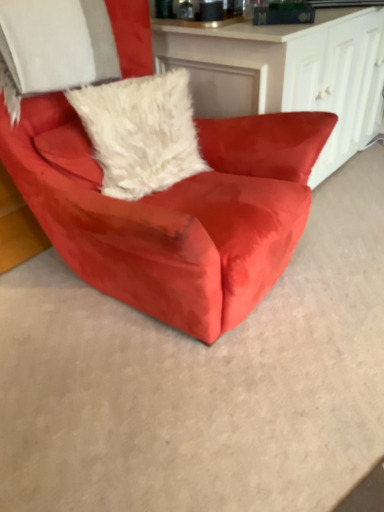
This screenshot has height=512, width=384. Describe the element at coordinates (173, 212) in the screenshot. I see `suede red armchair at center` at that location.

The width and height of the screenshot is (384, 512). What are the coordinates of `suede red armchair at center` in the screenshot? It's located at (173, 212).

What is the approximate width of suede red armchair at center?

The width of suede red armchair at center is 87.76 centimeters.

Locate an element on the screen. This screenshot has width=384, height=512. white fluffy pillow at center is located at coordinates (141, 132).

Looking at this image, measure the distance between white fluffy pillow at center and camera.

white fluffy pillow at center and camera are 1.26 meters apart from each other.

Image resolution: width=384 pixels, height=512 pixels. What do you see at coordinates (141, 132) in the screenshot?
I see `white fluffy pillow at center` at bounding box center [141, 132].

Identify the location of suede red armchair at center. (173, 212).

Is suede red armchair at center to the left or to the right of white fluffy pillow at center in the image?

suede red armchair at center is positioned on white fluffy pillow at center's right side.

Is the depth of suede red armchair at center less than that of white fluffy pillow at center?

Yes, suede red armchair at center is closer to the camera.

Which point is more distant from viewer, (308, 120) or (177, 87)?

Positioned behind is point (177, 87).

Consider the image. From the image's perspective, who appears lower, suede red armchair at center or white fluffy pillow at center?

suede red armchair at center, from the image's perspective.

From a real-world perspective, is suede red armchair at center on top of white fluffy pillow at center?

No, from a real-world perspective, suede red armchair at center is not on top of white fluffy pillow at center.

Which object is thinner, suede red armchair at center or white fluffy pillow at center?

With smaller width is white fluffy pillow at center.

Considering the relative sizes of suede red armchair at center and white fluffy pillow at center in the image provided, is suede red armchair at center taller than white fluffy pillow at center?

Indeed, suede red armchair at center has a greater height compared to white fluffy pillow at center.

Can you confirm if suede red armchair at center is smaller than white fluffy pillow at center?

No.

Is suede red armchair at center inside the boundaries of white fluffy pillow at center, or outside?

suede red armchair at center exists outside the volume of white fluffy pillow at center.

Is suede red armchair at center not close to white fluffy pillow at center?

That's not correct — suede red armchair at center is a little close to white fluffy pillow at center.

Is suede red armchair at center positioned with its back to white fluffy pillow at center?

That's right, suede red armchair at center is facing away from white fluffy pillow at center.

How distant is suede red armchair at center from white fluffy pillow at center?

The distance of suede red armchair at center from white fluffy pillow at center is 8.05 inches.

Find the location of a particular element. The height and width of the screenshot is (512, 384). pillow located above the suede red armchair at center (from the image's perspective) is located at coordinates click(x=141, y=132).

Which object is positioned more to the right, white fluffy pillow at center or suede red armchair at center?

suede red armchair at center is more to the right.

Is white fluffy pillow at center closer to camera compared to suede red armchair at center?

No.

Does point (193, 146) appear closer or farther from the camera than point (60, 212)?

Point (193, 146) is positioned farther from the camera compared to point (60, 212).

From the image's perspective, between white fluffy pillow at center and suede red armchair at center, which one is located above?

white fluffy pillow at center appears higher in the image.

From a real-world perspective, is white fluffy pillow at center above or below suede red armchair at center?

white fluffy pillow at center is above suede red armchair at center.

Can you confirm if white fluffy pillow at center is wider than suede red armchair at center?

No, white fluffy pillow at center is not wider than suede red armchair at center.

Considering the sizes of objects white fluffy pillow at center and suede red armchair at center in the image provided, who is shorter, white fluffy pillow at center or suede red armchair at center?

Standing shorter between the two is white fluffy pillow at center.

Does white fluffy pillow at center have a smaller size compared to suede red armchair at center?

Correct, white fluffy pillow at center occupies less space than suede red armchair at center.

Is white fluffy pillow at center outside of suede red armchair at center?

No, white fluffy pillow at center is not entirely external to suede red armchair at center.

Is white fluffy pillow at center touching suede red armchair at center?

No, white fluffy pillow at center is not touching suede red armchair at center.

Does white fluffy pillow at center turn towards suede red armchair at center?

Yes, white fluffy pillow at center is aimed at suede red armchair at center.

What's the angular difference between white fluffy pillow at center and suede red armchair at center's facing directions?

The angular difference between white fluffy pillow at center and suede red armchair at center is 10.4 degrees.

Measure the distance from white fluffy pillow at center to suede red armchair at center.

white fluffy pillow at center and suede red armchair at center are 8.05 inches apart.

Locate an element on the screen. The height and width of the screenshot is (512, 384). chair below the white fluffy pillow at center (from a real-world perspective) is located at coordinates (173, 212).

This screenshot has height=512, width=384. In order to click on chair below the white fluffy pillow at center (from the image's perspective) in this screenshot , I will do `click(173, 212)`.

Where is `pillow lying on the left of suede red armchair at center`? The width and height of the screenshot is (384, 512). pillow lying on the left of suede red armchair at center is located at coordinates (141, 132).